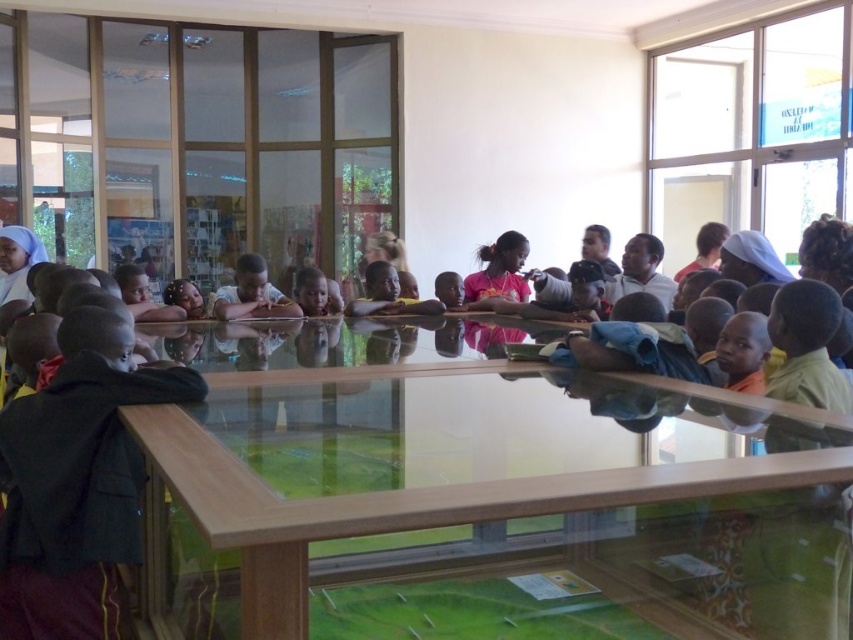
You are a photographer trying to capture a closeup shot of the reflective surface. You notice two points marked on the surface at coordinates point (709, 602) and point (508, 248). Which point should you focus on to ensure it appears larger in your photo?

Point (709, 602) is closer to the camera than point (508, 248), so focusing on point (709, 602) will make it appear larger in the photo.

You are a visitor at the community center and want to place the dark brown fabric jacket at left on the transparent glass table at center. Can the jacket fit on the table?

The transparent glass table at center is wider than the dark brown fabric jacket at left, so yes, the jacket can fit on the table.